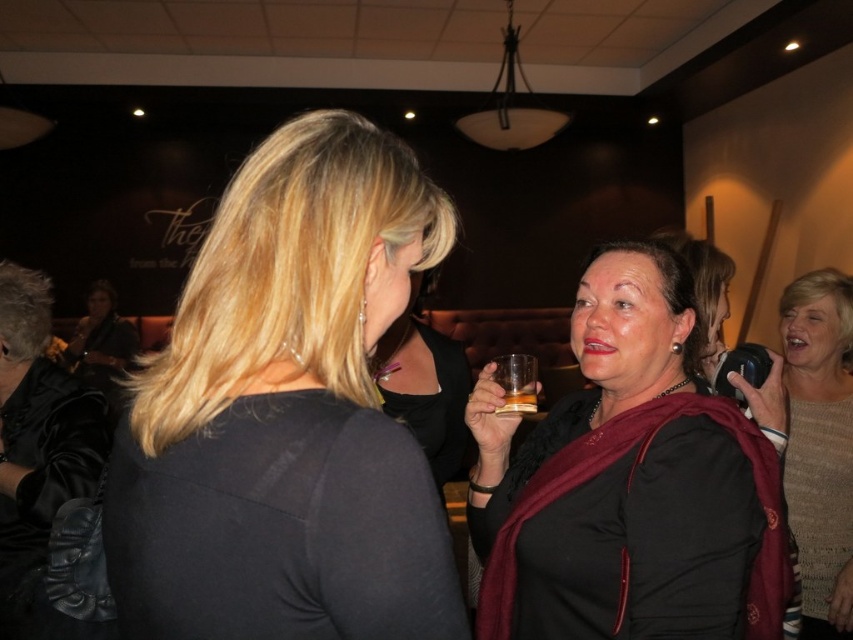
Is matte black guitar at left positioned behind translucent glass at center?

Yes, it is behind translucent glass at center.

Who is more forward, (88,368) or (521,392)?

Point (521,392) is in front.

Where is `matte black guitar at left`? Image resolution: width=853 pixels, height=640 pixels. matte black guitar at left is located at coordinates (102, 339).

Is point (395, 216) farther from camera compared to point (508, 401)?

No, (395, 216) is closer to viewer.

Does point (122, 472) come in front of point (508, 372)?

Yes, it is in front of point (508, 372).

The width and height of the screenshot is (853, 640). Identify the location of matte black shirt at center. (287, 413).

Who is lower down, matte black sweater at center or translucent glass at center?

Positioned lower is matte black sweater at center.

Is matte black sweater at center to the right of translucent glass at center from the viewer's perspective?

Correct, you'll find matte black sweater at center to the right of translucent glass at center.

Where is `matte black sweater at center`? matte black sweater at center is located at coordinates (630, 483).